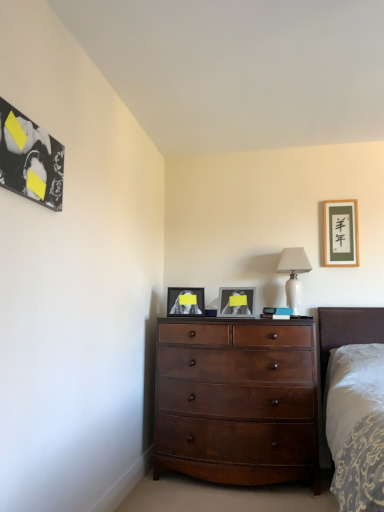
Question: Does matte black picture frame at center, the third picture frame positioned from the front, have a lesser width compared to mahogany wood dresser at center?

Choices:
 (A) yes
 (B) no

Answer: (A)

Question: Are matte black picture frame at center, arranged as the 2th picture frame when viewed from the back, and mahogany wood dresser at center located far from each other?

Choices:
 (A) no
 (B) yes

Answer: (A)

Question: From a real-world perspective, is matte black picture frame at center, marked as the 3th picture frame in a right-to-left arrangement, on mahogany wood dresser at center?

Choices:
 (A) no
 (B) yes

Answer: (B)

Question: Is the position of matte black picture frame at center, marked as the 3th picture frame in a right-to-left arrangement, less distant than that of mahogany wood dresser at center?

Choices:
 (A) yes
 (B) no

Answer: (B)

Question: Is matte black picture frame at center, which is the second picture frame from left to right, to the left of mahogany wood dresser at center from the viewer's perspective?

Choices:
 (A) yes
 (B) no

Answer: (A)

Question: From the image's perspective, is matte black picture frame at center, arranged as the 2th picture frame when viewed from the back, below mahogany wood dresser at center?

Choices:
 (A) yes
 (B) no

Answer: (B)

Question: Does mahogany wood dresser at center have a larger size compared to matte black picture frame at center, marked as the 3th picture frame in a right-to-left arrangement?

Choices:
 (A) yes
 (B) no

Answer: (A)

Question: From the image's perspective, is mahogany wood dresser at center below matte black picture frame at center, the third picture frame positioned from the front?

Choices:
 (A) yes
 (B) no

Answer: (A)

Question: Is mahogany wood dresser at center closer to camera compared to matte black picture frame at center, which is the second picture frame from left to right?

Choices:
 (A) yes
 (B) no

Answer: (A)

Question: Is the surface of mahogany wood dresser at center in direct contact with matte black picture frame at center, which is the second picture frame from left to right?

Choices:
 (A) no
 (B) yes

Answer: (A)

Question: From a real-world perspective, is mahogany wood dresser at center located higher than matte black picture frame at center, marked as the 3th picture frame in a right-to-left arrangement?

Choices:
 (A) yes
 (B) no

Answer: (B)

Question: From the image's perspective, does mahogany wood dresser at center appear higher than matte black picture frame at center, arranged as the 2th picture frame when viewed from the back?

Choices:
 (A) yes
 (B) no

Answer: (B)

Question: Can you confirm if matte gold picture frame at upper right, which appears as the fourth picture frame when viewed from the front, is positioned to the right of black glossy picture frame at upper left, acting as the first picture frame starting from the left?

Choices:
 (A) yes
 (B) no

Answer: (A)